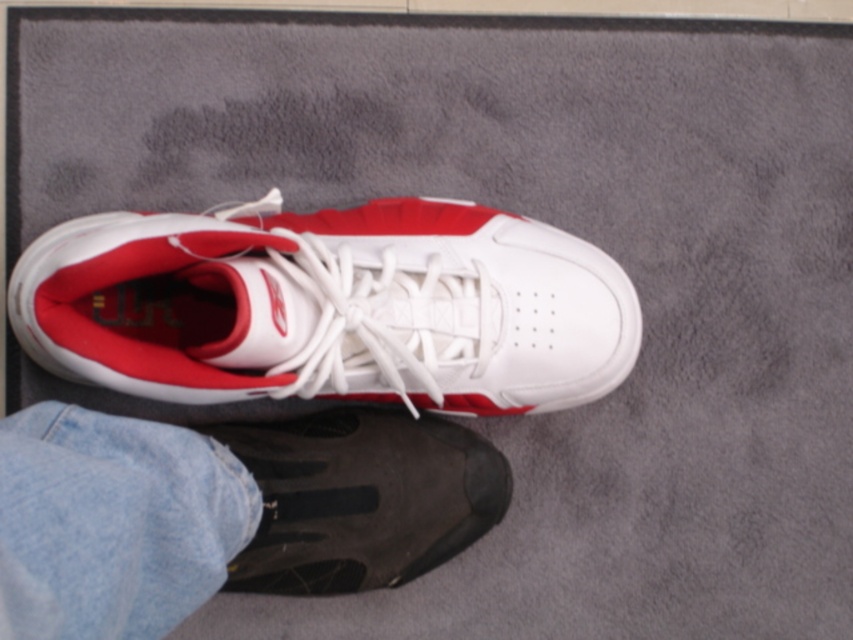
Question: Among these points, which one is farthest from the camera?

Choices:
 (A) (349, 422)
 (B) (248, 483)

Answer: (A)

Question: Among these objects, which one is nearest to the camera?

Choices:
 (A) black rubber shoe at lower center
 (B) white matte/suede sneaker at center

Answer: (A)

Question: Which point is farther to the camera?

Choices:
 (A) (183, 577)
 (B) (341, 342)
 (C) (279, 433)

Answer: (C)

Question: Is white matte/suede sneaker at center smaller than black rubber shoe at lower center?

Choices:
 (A) yes
 (B) no

Answer: (A)

Question: Can you confirm if white matte/suede sneaker at center is positioned below black mesh shoe at lower center?

Choices:
 (A) no
 (B) yes

Answer: (A)

Question: In this image, where is white matte/suede sneaker at center located relative to black rubber shoe at lower center?

Choices:
 (A) right
 (B) left

Answer: (A)